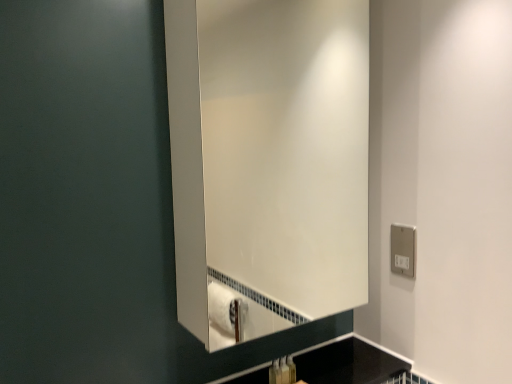
Question: Does matte plastic toothbrush at lower center, positioned as the first toiletry in right-to-left order, come in front of white glossy mirror at center?

Choices:
 (A) no
 (B) yes

Answer: (A)

Question: Does matte plastic toothbrush at lower center, which appears as the second toiletry when viewed from the left, have a larger size compared to white glossy mirror at center?

Choices:
 (A) no
 (B) yes

Answer: (A)

Question: Is matte plastic toothbrush at lower center, positioned as the first toiletry in right-to-left order, at the left side of white glossy mirror at center?

Choices:
 (A) no
 (B) yes

Answer: (A)

Question: Is matte plastic toothbrush at lower center, which appears as the second toiletry when viewed from the left, thinner than white glossy mirror at center?

Choices:
 (A) no
 (B) yes

Answer: (B)

Question: Is matte plastic toothbrush at lower center, positioned as the first toiletry in right-to-left order, shorter than white glossy mirror at center?

Choices:
 (A) yes
 (B) no

Answer: (A)

Question: Are matte plastic toothbrush at lower center, positioned as the first toiletry in right-to-left order, and white glossy mirror at center beside each other?

Choices:
 (A) yes
 (B) no

Answer: (B)

Question: From a real-world perspective, is silver metallic electric outlet at right below matte plastic toothbrush at lower center, which appears as the second toiletry when viewed from the left?

Choices:
 (A) no
 (B) yes

Answer: (A)

Question: From the image's perspective, is silver metallic electric outlet at right over matte plastic toothbrush at lower center, which appears as the second toiletry when viewed from the left?

Choices:
 (A) yes
 (B) no

Answer: (A)

Question: Is silver metallic electric outlet at right at the right side of matte plastic toothbrush at lower center, which appears as the second toiletry when viewed from the left?

Choices:
 (A) yes
 (B) no

Answer: (A)

Question: From a real-world perspective, is silver metallic electric outlet at right located higher than matte plastic toothbrush at lower center, positioned as the first toiletry in right-to-left order?

Choices:
 (A) no
 (B) yes

Answer: (B)

Question: Is silver metallic electric outlet at right behind matte plastic toothbrush at lower center, positioned as the first toiletry in right-to-left order?

Choices:
 (A) no
 (B) yes

Answer: (B)

Question: Can you confirm if silver metallic electric outlet at right is wider than matte plastic toothbrush at lower center, which appears as the second toiletry when viewed from the left?

Choices:
 (A) yes
 (B) no

Answer: (B)

Question: Would you say silver metallic electric outlet at right is outside translucent plastic soap dispenser at lower center, the 2th toiletry viewed from the right?

Choices:
 (A) no
 (B) yes

Answer: (B)